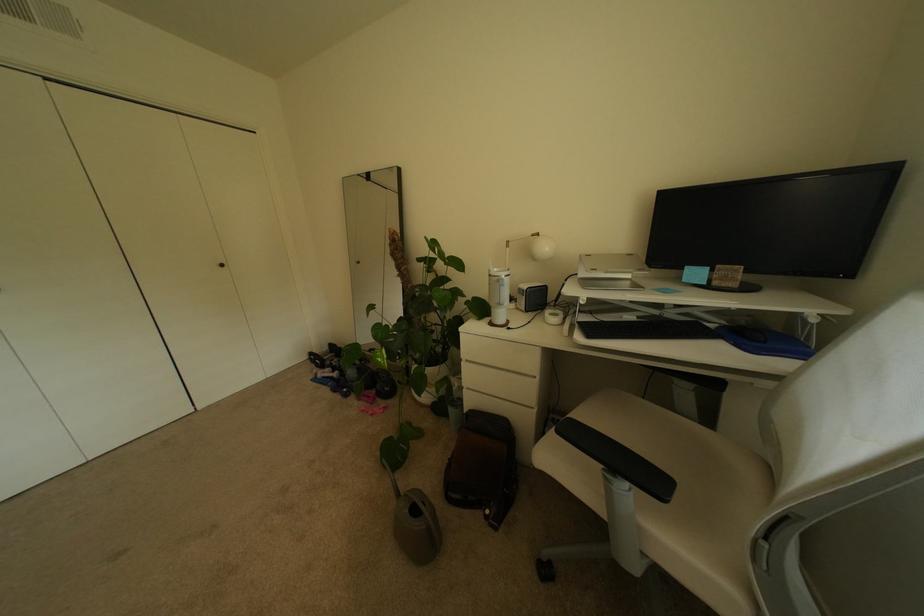
Find where to resting arm the black chair armrest. Please return your answer as a coordinate pair (x, y).

(636, 471)